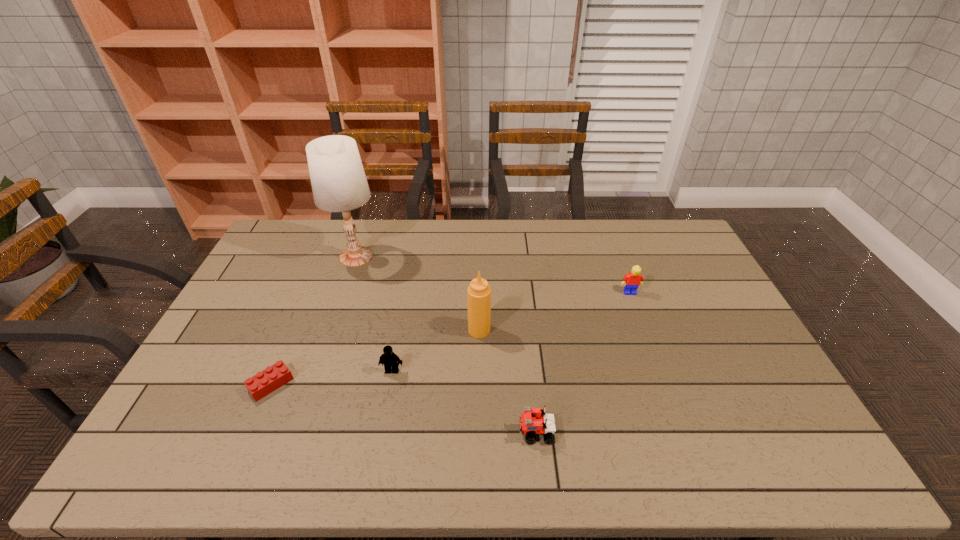
This screenshot has height=540, width=960. Identify the location of object situated at the near edge. (533, 421).

In the image, there is a desktop. Identify the location of vacant space at the far edge. Image resolution: width=960 pixels, height=540 pixels. (453, 237).

Locate an element on the screen. This screenshot has height=540, width=960. vacant space at the near edge is located at coordinates (290, 465).

This screenshot has width=960, height=540. What are the coordinates of `vacant space at the left edge` in the screenshot? It's located at [x=232, y=354].

In the image, there is a desktop. Identify the location of vacant space at the right edge. (691, 291).

This screenshot has height=540, width=960. Find the location of `free space at the far left corner of the desktop`. free space at the far left corner of the desktop is located at coordinates (290, 232).

In the image, there is a desktop. Where is `vacant space at the near right corner`? vacant space at the near right corner is located at coordinates (773, 443).

This screenshot has height=540, width=960. I want to click on empty space between the shortest object and the third object from left to right, so click(331, 377).

The height and width of the screenshot is (540, 960). Identify the location of free space that is in between the nearest object and the tallest object. (446, 345).

Find the location of `unoccupied position between the farthest object and the second Lego from left to right`. unoccupied position between the farthest object and the second Lego from left to right is located at coordinates (374, 314).